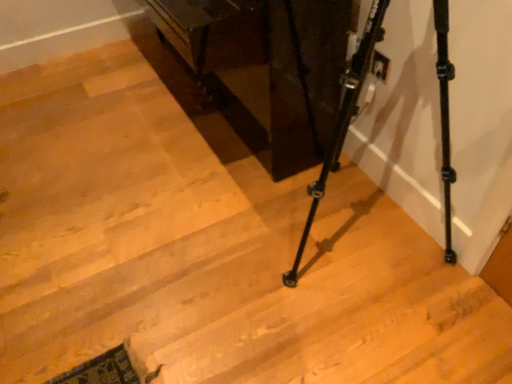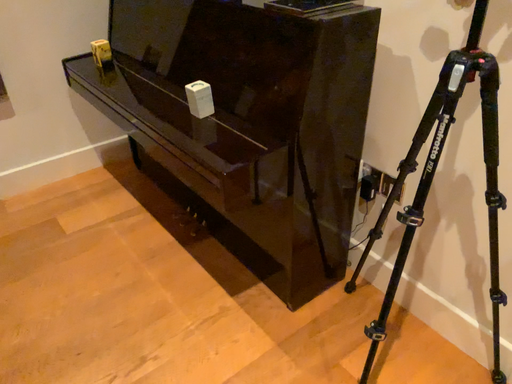
Question: Which way did the camera rotate in the video?

Choices:
 (A) rotated downward
 (B) rotated upward

Answer: (B)